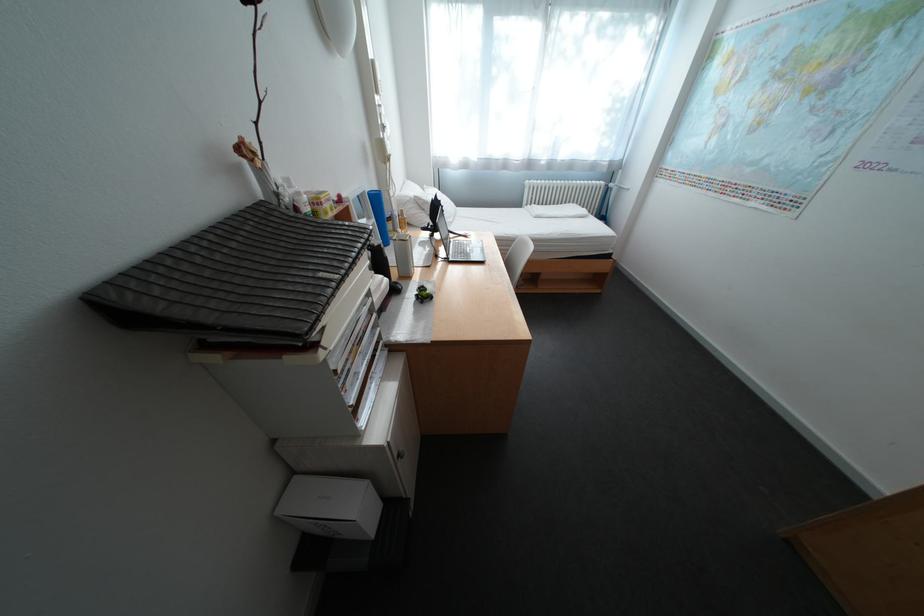
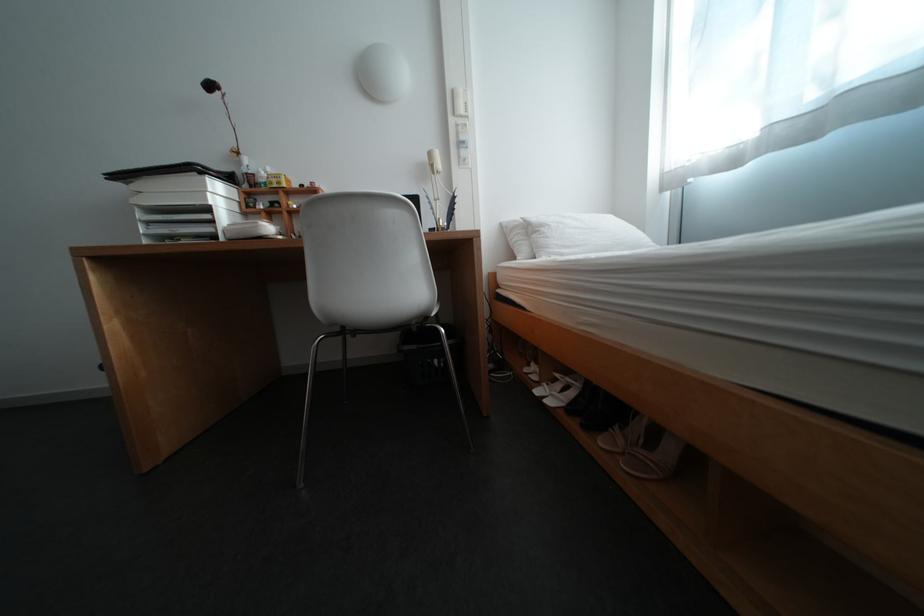
The point at (385, 63) is marked in the first image. Where is the corresponding point in the second image?

(466, 92)